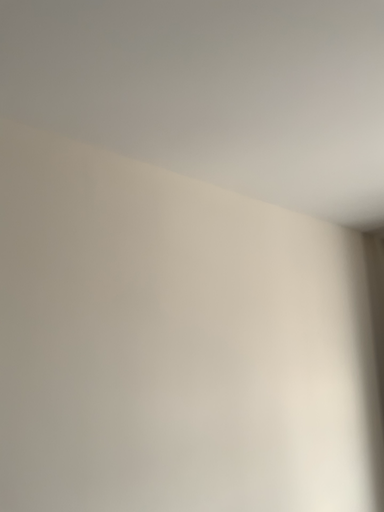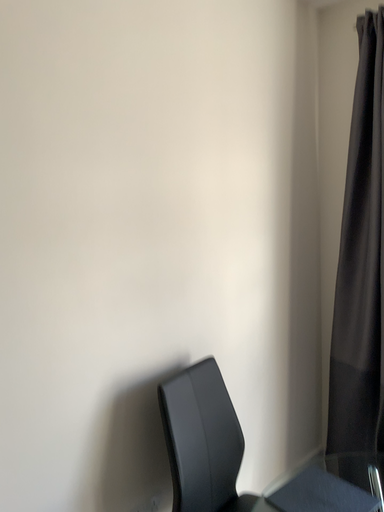
Question: Which way did the camera rotate in the video?

Choices:
 (A) rotated right
 (B) rotated left

Answer: (A)